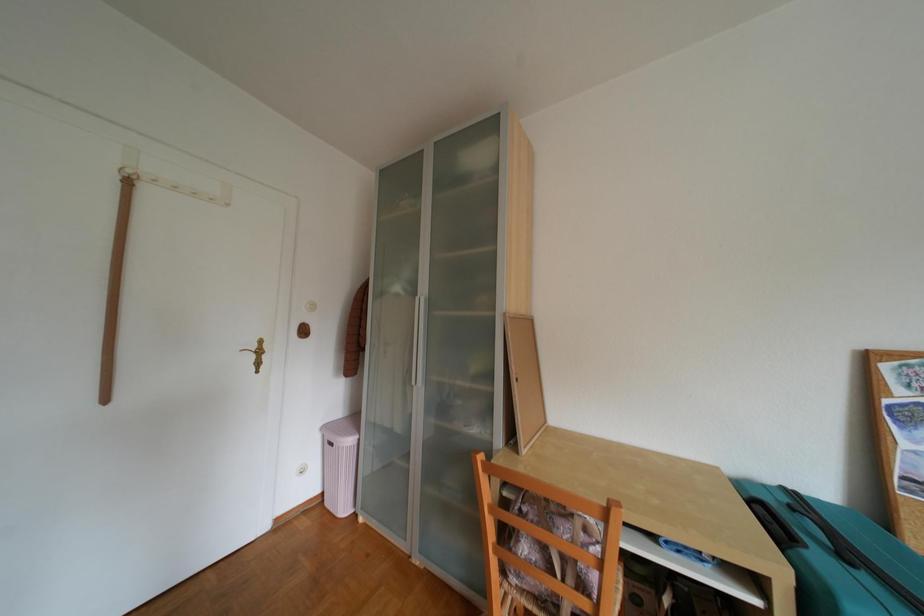
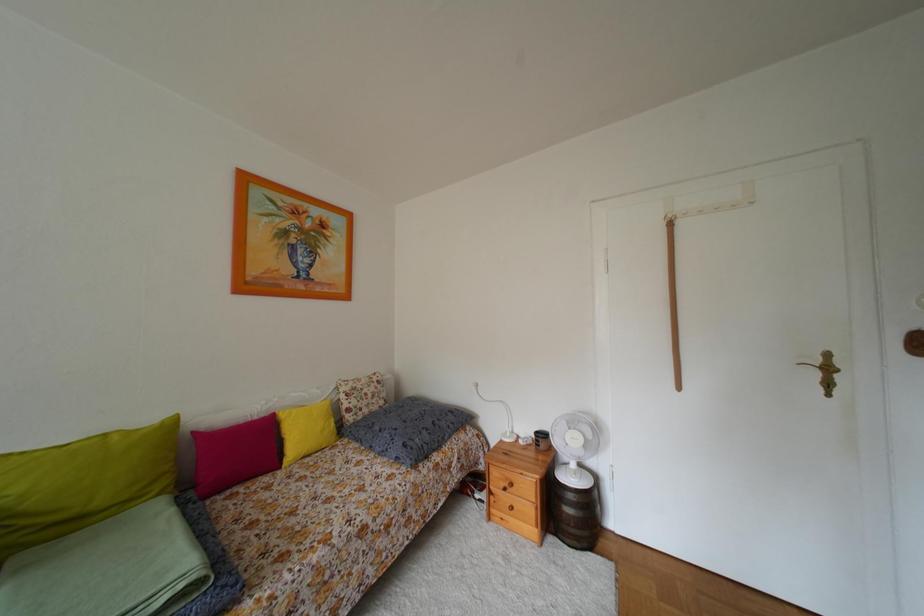
Question: The camera is either moving clockwise (left) or counter-clockwise (right) around the object. The first image is from the beginning of the video and the second image is from the end. Is the camera moving left or right when shooting the video?

Choices:
 (A) Left
 (B) Right

Answer: (B)